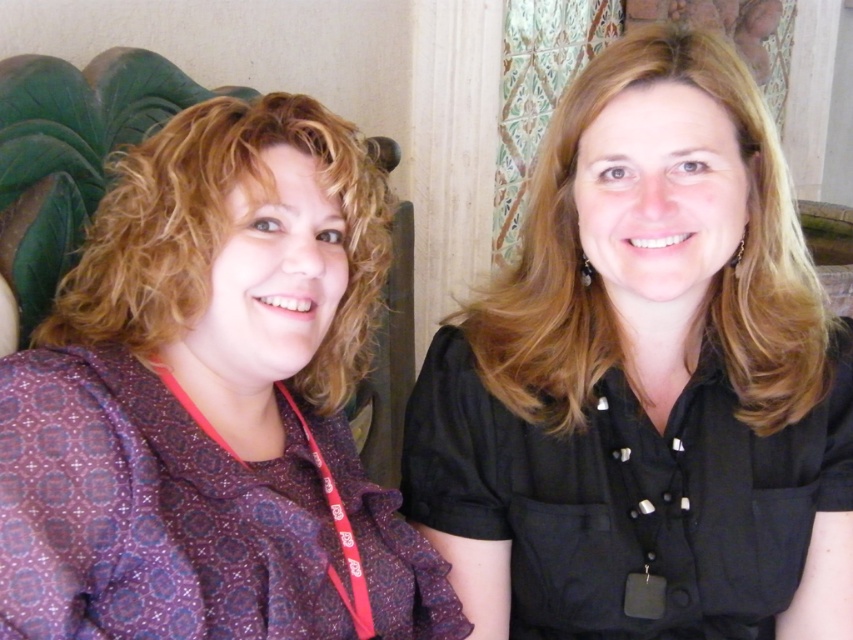
Question: Which object is closer to the camera taking this photo?

Choices:
 (A) black matte shirt at upper right
 (B) purple printed blouse at left

Answer: (B)

Question: From the image, what is the correct spatial relationship of black matte shirt at upper right in relation to purple printed blouse at left?

Choices:
 (A) right
 (B) left

Answer: (A)

Question: Can you confirm if black matte shirt at upper right is positioned to the left of purple printed blouse at left?

Choices:
 (A) no
 (B) yes

Answer: (A)

Question: Which point is closer to the camera taking this photo?

Choices:
 (A) (611, 385)
 (B) (225, 532)

Answer: (B)

Question: Does black matte shirt at upper right have a smaller size compared to purple printed blouse at left?

Choices:
 (A) no
 (B) yes

Answer: (A)